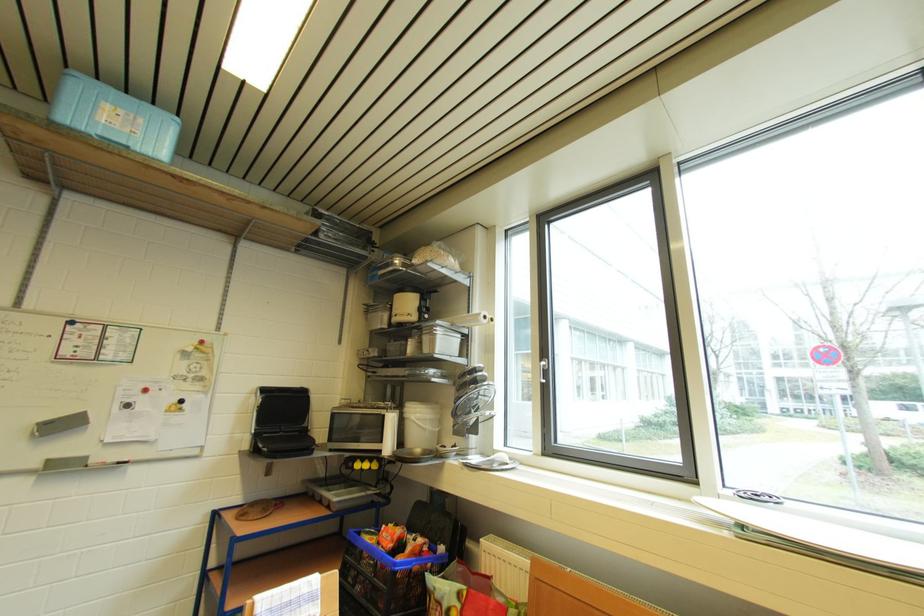
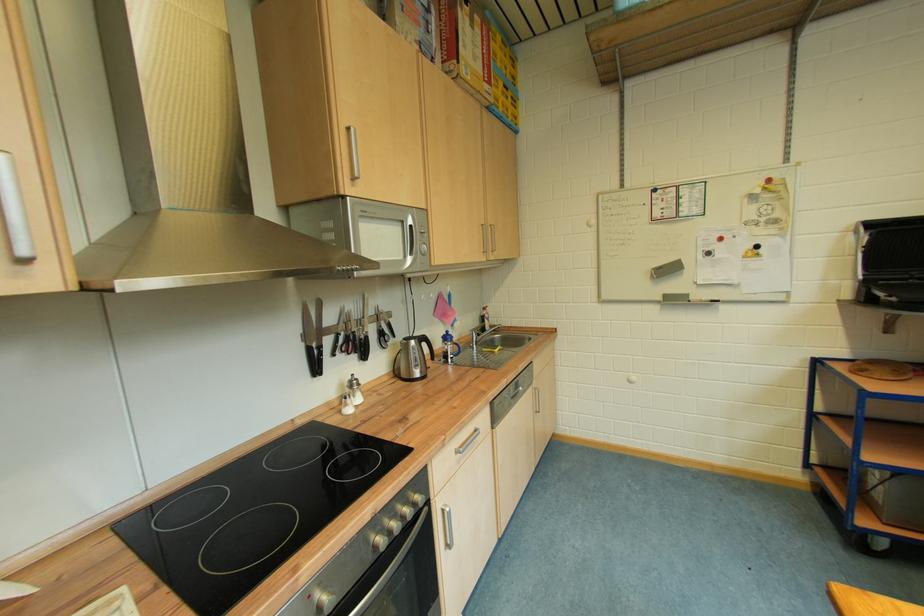
Question: The first image is from the beginning of the video and the second image is from the end. How did the camera likely rotate when shooting the video?

Choices:
 (A) Left
 (B) Right
 (C) Up
 (D) Down

Answer: (A)